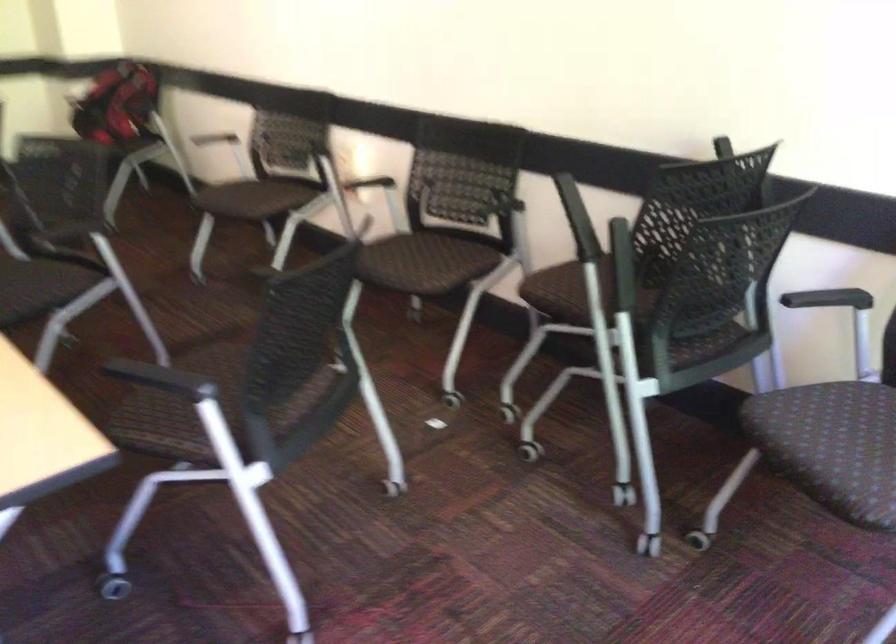
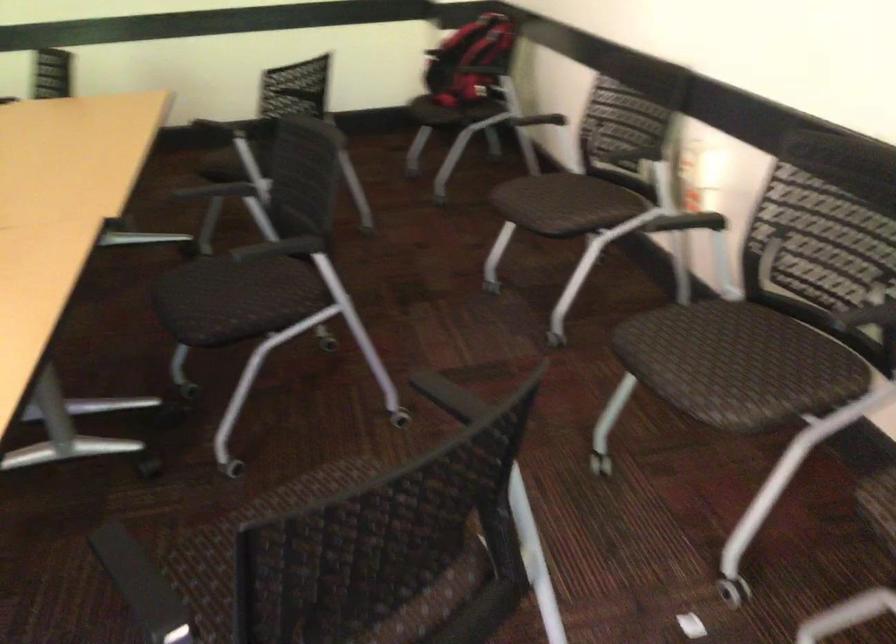
Locate, in the second image, the point that corresponds to (418,245) in the first image.

(735, 335)